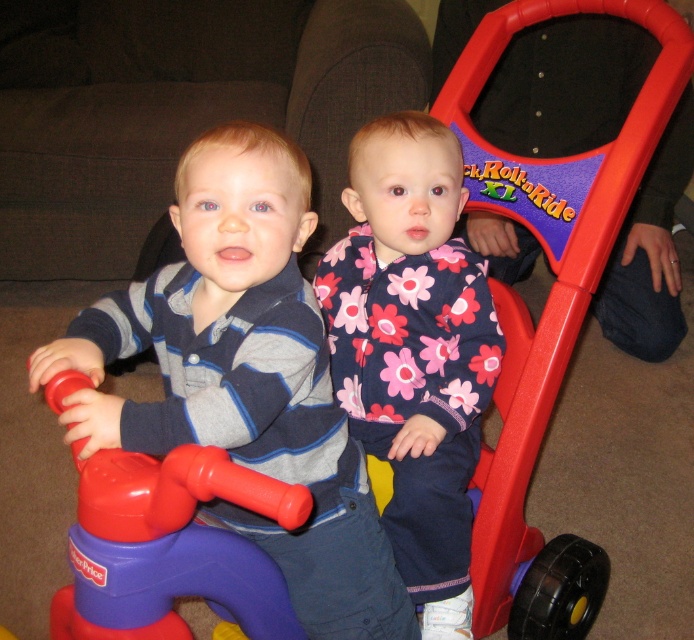
You are taking a photo of the two children on the toy walker. You want to focus on the point that is closer to the camera. Which point should you choose between point (266,540) and point (364,348)?

Point (266,540) is closer to the camera than point (364,348), so you should choose point (266,540) to focus on.

You are a parent trying to clean the area around the toy walker. You need to move the matte plastic boy at center and the rubberized plastic toy at center to a storage bin. Which object should you move first to access the other one more easily?

The matte plastic boy at center is further to the viewer than the rubberized plastic toy at center, so you should move the matte plastic boy at center first to access the rubberized plastic toy at center behind it.

You are a parent trying to decide which item to pack for a trip. You have the floral fabric jacket at center and the rubberized plastic toy at center. Which item takes up more space in your luggage?

The floral fabric jacket at center is bigger than the rubberized plastic toy at center, so it will take up more space in your luggage.